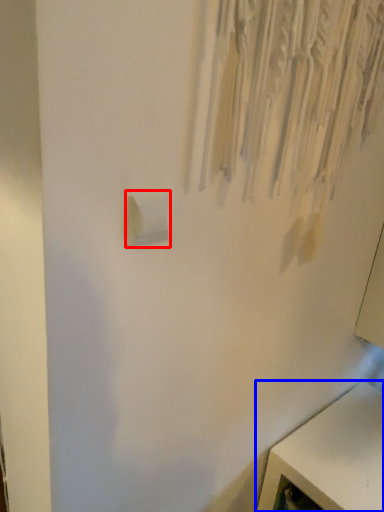
Question: Which point is further to the camera, light switch (highlighted by a red box) or furniture (highlighted by a blue box)?

Choices:
 (A) light switch
 (B) furniture

Answer: (B)